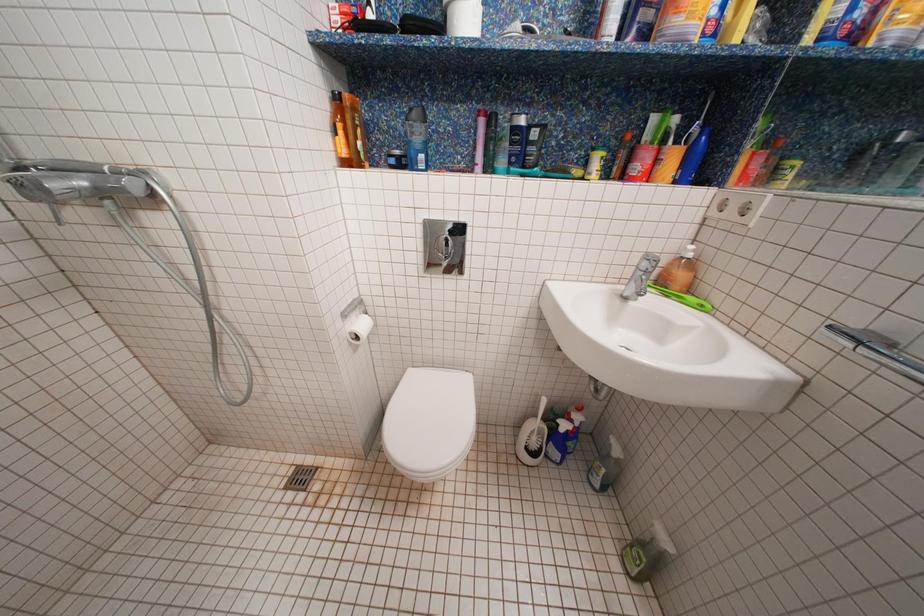
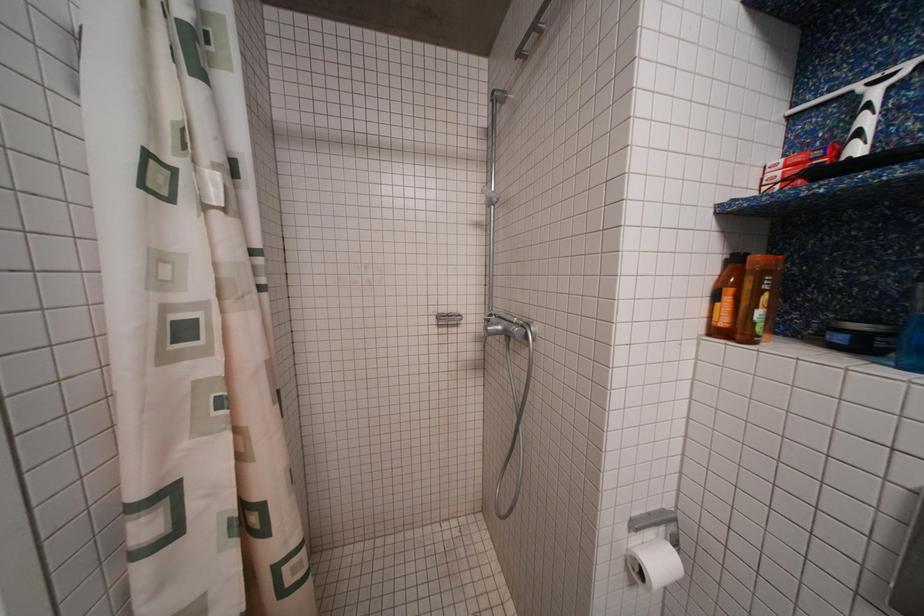
Question: Based on the continuous images, in which direction is the camera rotating? Reply with the corresponding letter.

Choices:
 (A) Left
 (B) Right
 (C) Up
 (D) Down

Answer: (A)